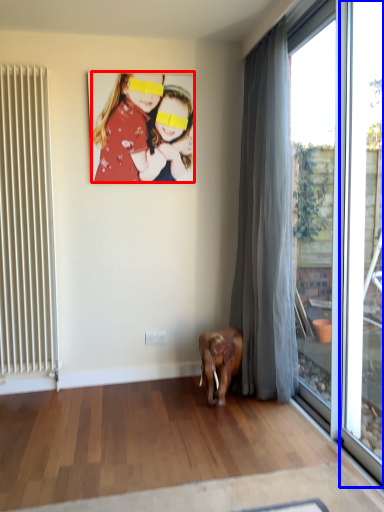
Question: Which object appears farthest to the camera in this image, person (highlighted by a red box) or window frame (highlighted by a blue box)?

Choices:
 (A) person
 (B) window frame

Answer: (A)